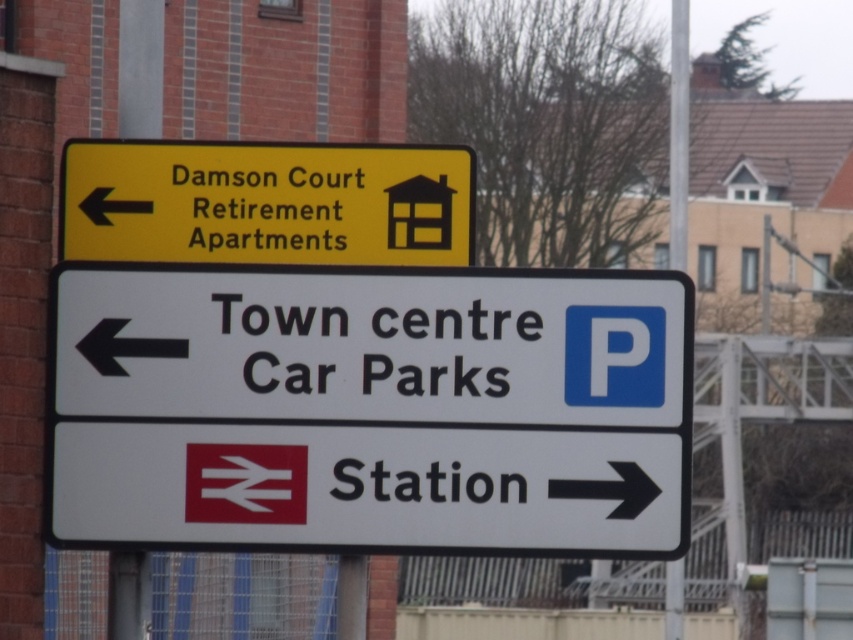
You are a delivery driver who needs to secure a parking spot near the town centre. You see the white plastic sign at left and the white plastic pole at upper center in the image. Which object is smaller in size?

The white plastic sign at left has a smaller size compared to the white plastic pole at upper center.

You are standing at the intersection and see the point marked at coordinates (265, 202). Which sign does this point to? Please answer with the exact object label from the scene description.

The point at coordinates (265, 202) corresponds to the yellow matte sign at upper left, which indicates the direction to Damson Court Retirement Apartments.

You are standing at the intersection and see the point at coordinates (372, 344). What object is located at that point?

The point at coordinates (372, 344) indicates a white plastic sign at left.